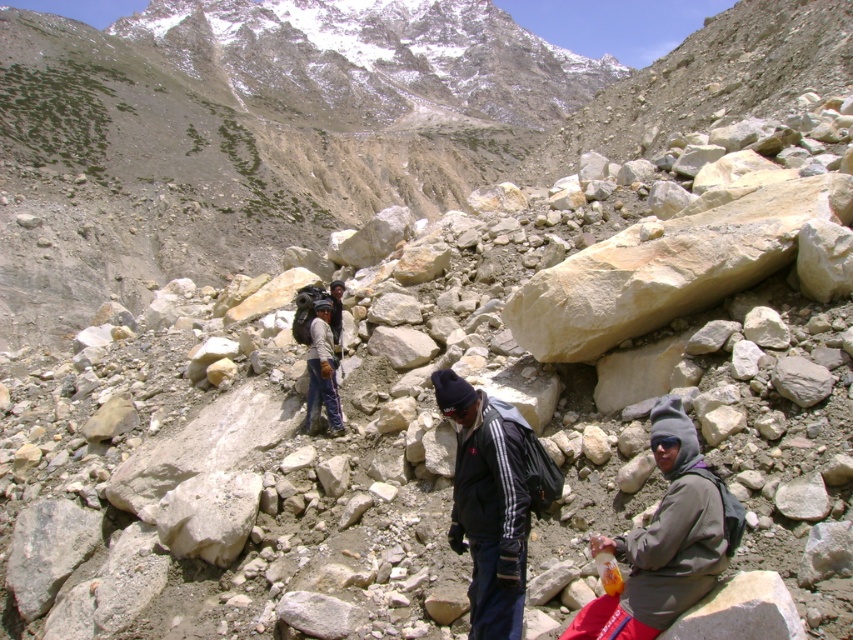
You are a hiker trying to determine the best path through the rocky terrain. You notice two hikers wearing the gray fleece jacket at lower right and the dark gray fleece jacket at center. Which hiker is shorter in height?

The gray fleece jacket at lower right is not as tall as the dark gray fleece jacket at center, so the hiker wearing the gray fleece jacket at lower right is shorter in height.

You are part of a hiking group in the mountainous terrain. You notice two hikers wearing fleece jackets. One is wearing a gray fleece jacket at lower right and the other a dark gray fleece jacket at center. From your perspective, which hiker is positioned more to the east?

The gray fleece jacket at lower right is positioned to the right of the dark gray fleece jacket at center, so the hiker in the gray fleece jacket at lower right is more to the east.

You are a hiker planning to carry both the gray fleece jacket at lower right and the dark gray fleece jacket at center in your backpack. Given their sizes, which one will take up more space in your backpack?

The dark gray fleece jacket at center takes up more space in the backpack because its width is greater than the gray fleece jacket at lower right.